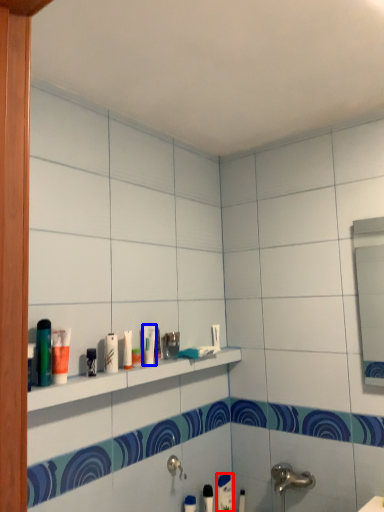
Question: Which point is further to the camera, toothpaste (highlighted by a red box) or toiletry (highlighted by a blue box)?

Choices:
 (A) toothpaste
 (B) toiletry

Answer: (A)